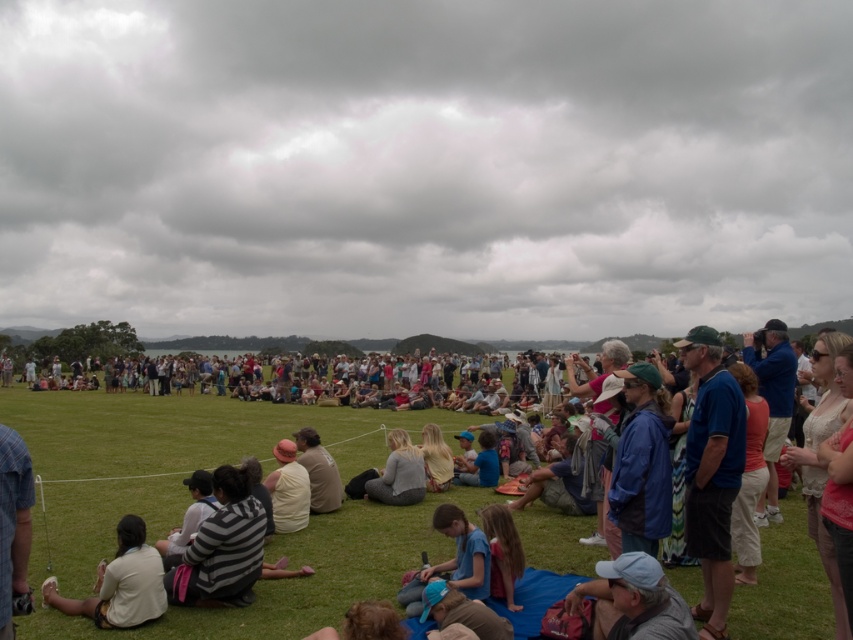
You are a photographer at the event and want to capture both the light blue fabric cap at lower center and the light beige shirt at lower left in a single frame. Which object should you focus on first to ensure both are in the frame?

The light blue fabric cap at lower center is thinner than the light beige shirt at lower left, so you should focus on the light beige shirt at lower left first to ensure both are in the frame.

You are a photographer at the event and want to capture both the light blue fabric cap at lower center and the light beige shirt at lower left in a single frame. Which object should you focus on first to ensure both are in the frame?

You should focus on the light blue fabric cap at lower center first because it is larger in size compared to the light beige shirt at lower left, ensuring it fits within the frame while also capturing the smaller object.